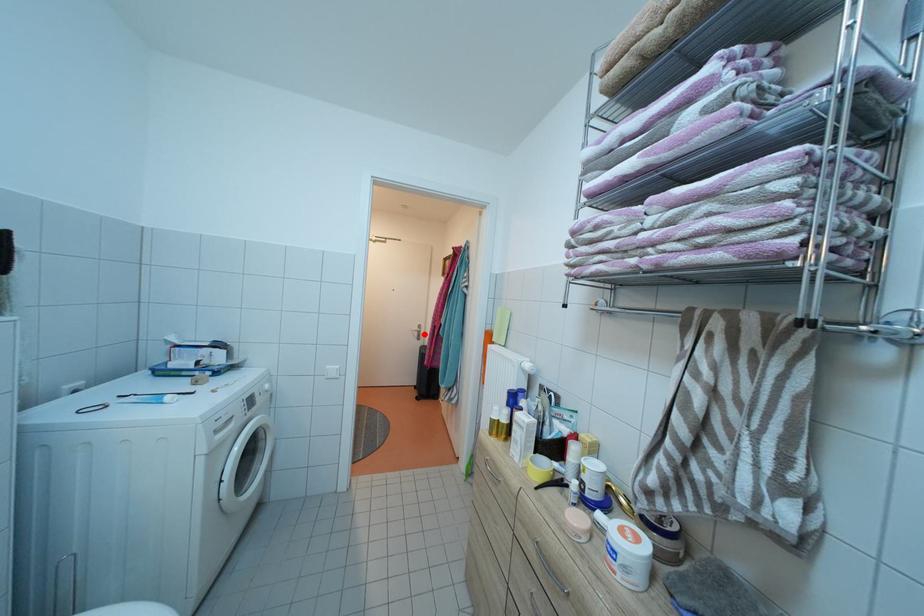
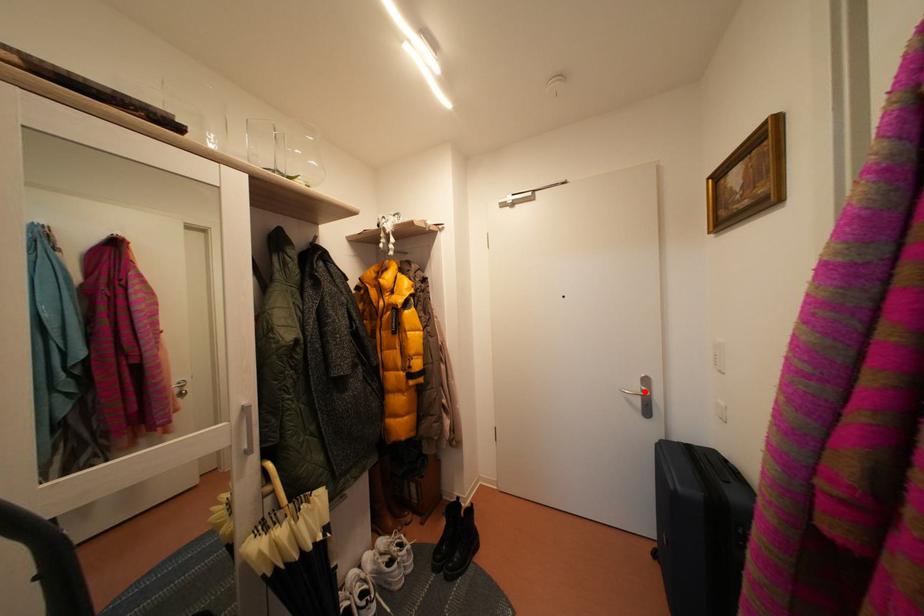
I am providing you with two images of the same scene from different viewpoints. A red point is marked on the first image and another point is marked on the second image. Does the point marked in image1 correspond to the same location as the one in image2?

Yes